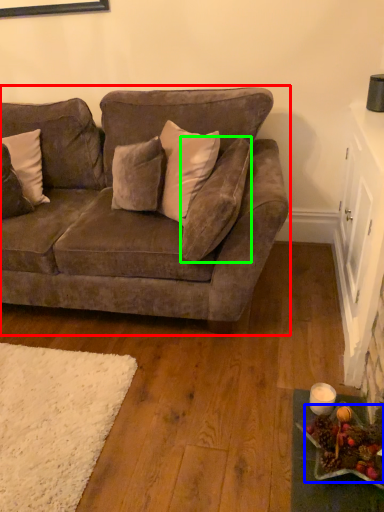
Question: Considering the real-world distances, which object is farthest from studio couch (highlighted by a red box)? food (highlighted by a blue box) or pillow (highlighted by a green box)?

Choices:
 (A) food
 (B) pillow

Answer: (A)